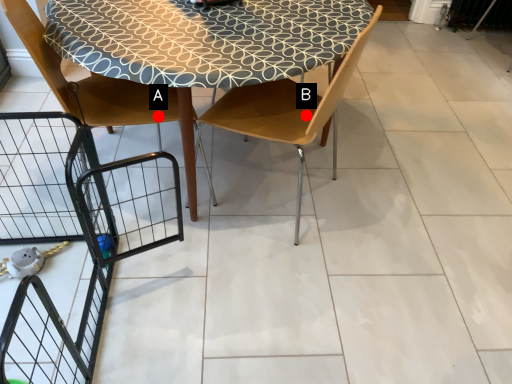
Question: Two points are circled on the image, labeled by A and B beside each circle. Which point appears farthest from the camera in this image?

Choices:
 (A) A is further
 (B) B is further

Answer: (B)